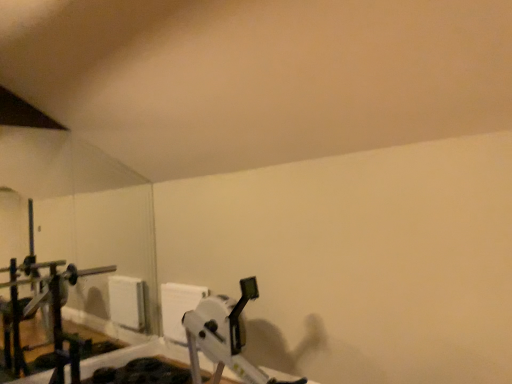
What is the approximate width of metallic gray vacuum cleaner at left?

metallic gray vacuum cleaner at left is 1.58 inches wide.

You are a GUI agent. You are given a task and a screenshot of the screen. Output one action in this format:
    pyautogui.click(x=<x>, y=<y>)
    Task: Click on the metallic gray vacuum cleaner at left
    
    Given the screenshot: What is the action you would take?
    pyautogui.click(x=44, y=305)

The height and width of the screenshot is (384, 512). Describe the element at coordinates (44, 305) in the screenshot. I see `metallic gray vacuum cleaner at left` at that location.

This screenshot has height=384, width=512. I want to click on metallic gray vacuum cleaner at left, so click(44, 305).